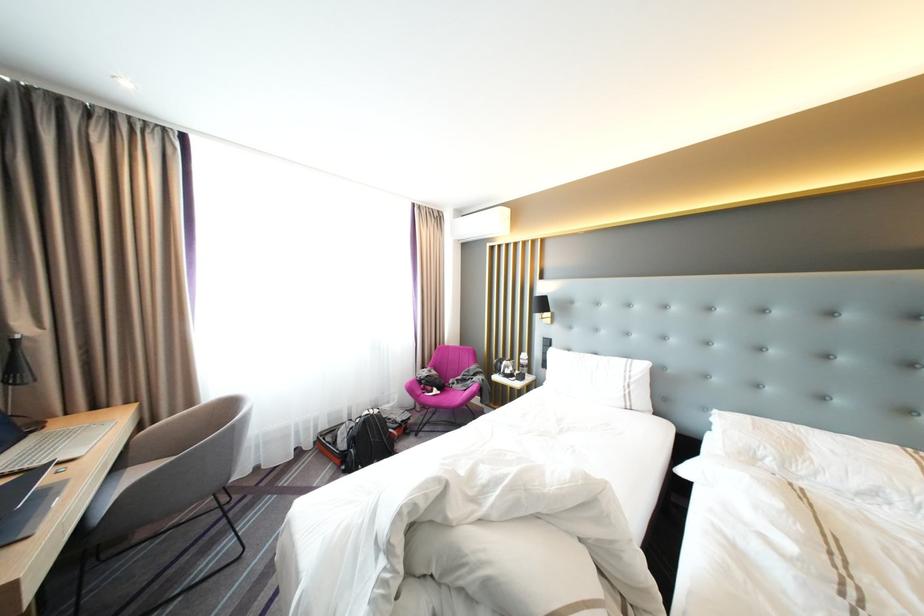
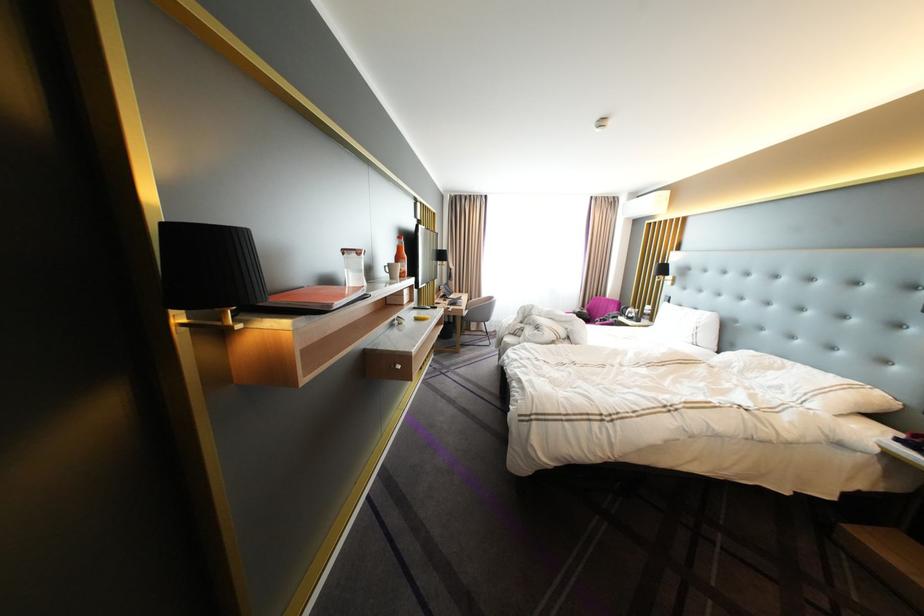
Where in the second image is the point corresponding to point (439, 377) from the first image?

(590, 313)